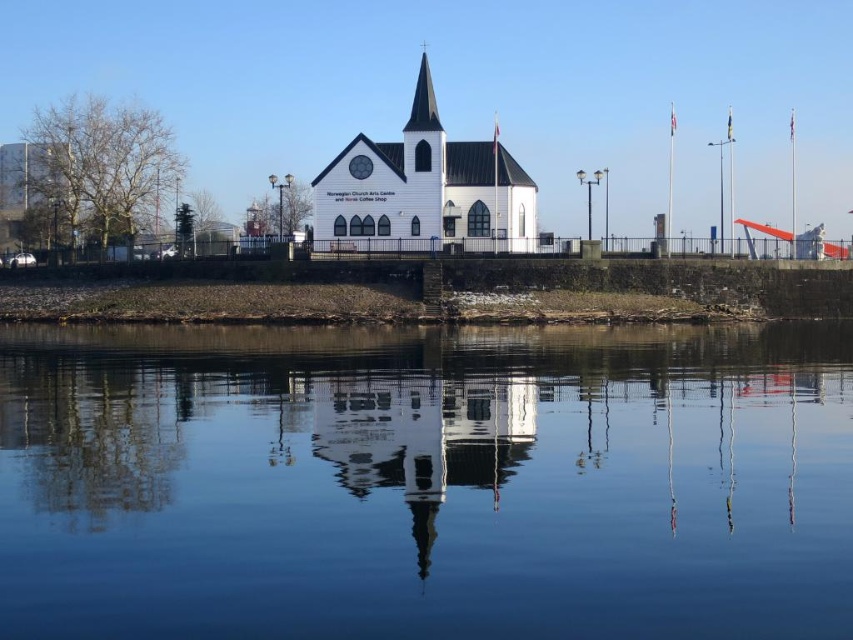
You are a photographer planning to capture the white wooden church at center and the black glass spire at center in a single shot. Based on their heights, which one should you position closer to the foreground to ensure both are fully visible in the frame?

The white wooden church at center is taller than the black glass spire at center. To ensure both are fully visible in the frame, position the white wooden church at center closer to the foreground so its height doesn

You are a tourist standing in front of the church and want to take a photo that includes both the transparent glass water at center and the black glass spire at center. Which object will appear taller in the photo?

The black glass spire at center will appear taller in the photo since it has a greater height compared to the transparent glass water at center.

You are standing at the point closest to the camera in the image. You want to walk to the point labeled as point (631,378). How far will you have to walk?

The distance of point (631,378) from camera is 99.71 meters, so you will have to walk 99.71 meters to reach it.